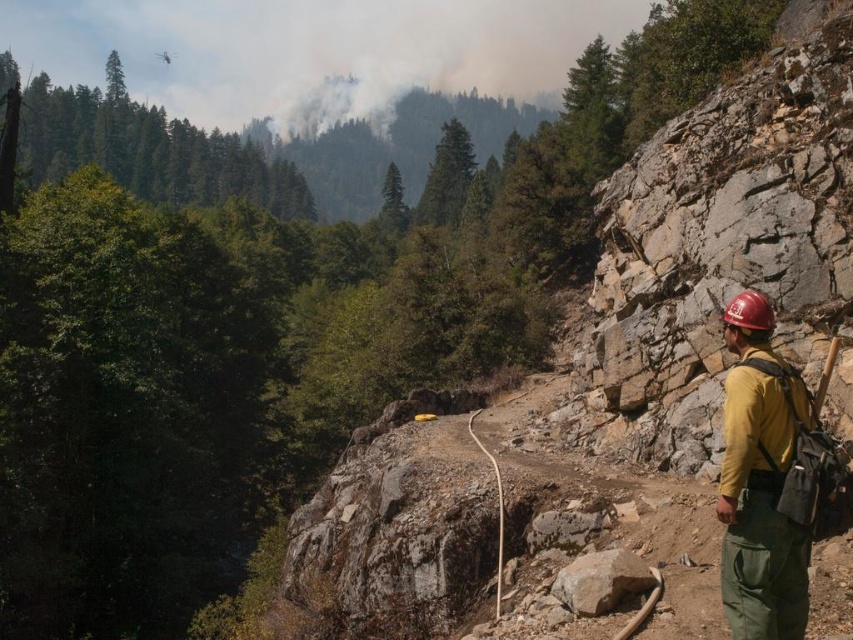
Does point (741, 333) lie behind point (585, 598)?

No, it is in front of (585, 598).

Between yellow fabric backpack at right and gray rough rock at center, which one appears on the left side from the viewer's perspective?

From the viewer's perspective, gray rough rock at center appears more on the left side.

Who is more distant from viewer, (747, 330) or (563, 600)?

Point (563, 600)

The width and height of the screenshot is (853, 640). Find the location of `yellow fabric backpack at right`. yellow fabric backpack at right is located at coordinates (759, 481).